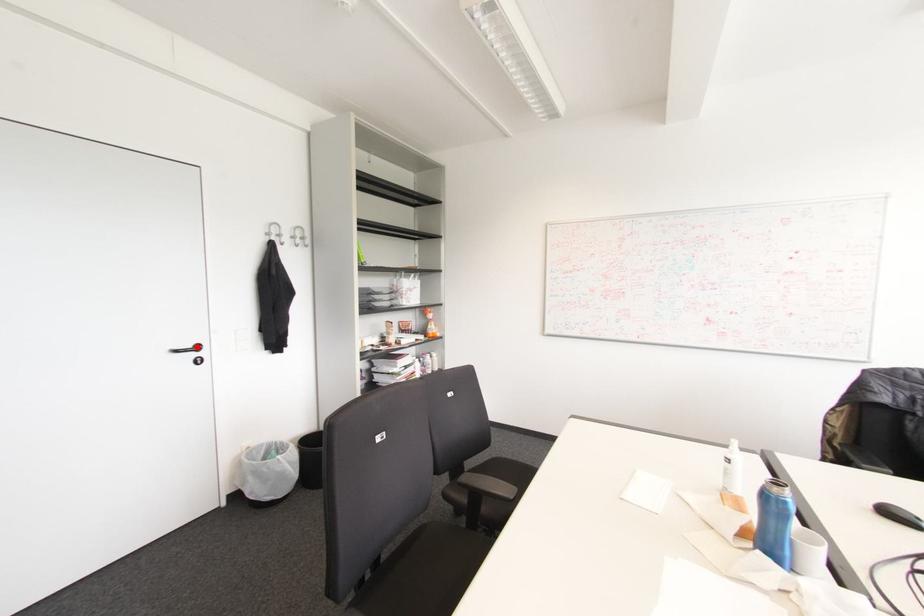
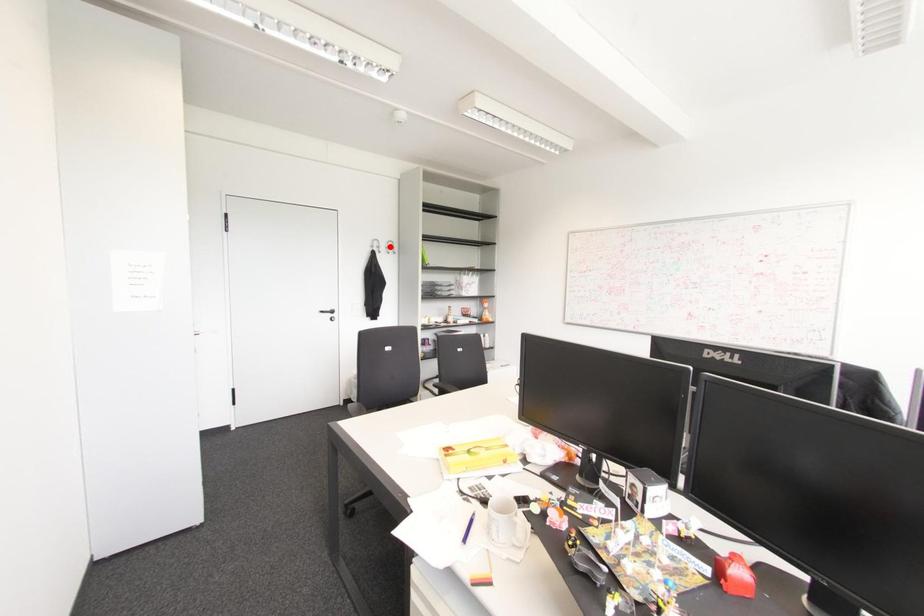
I am providing you with two images of the same scene from different viewpoints. A red point is marked on the first image and another point is marked on the second image. Does the point marked in image1 correspond to the same location as the one in image2?

No